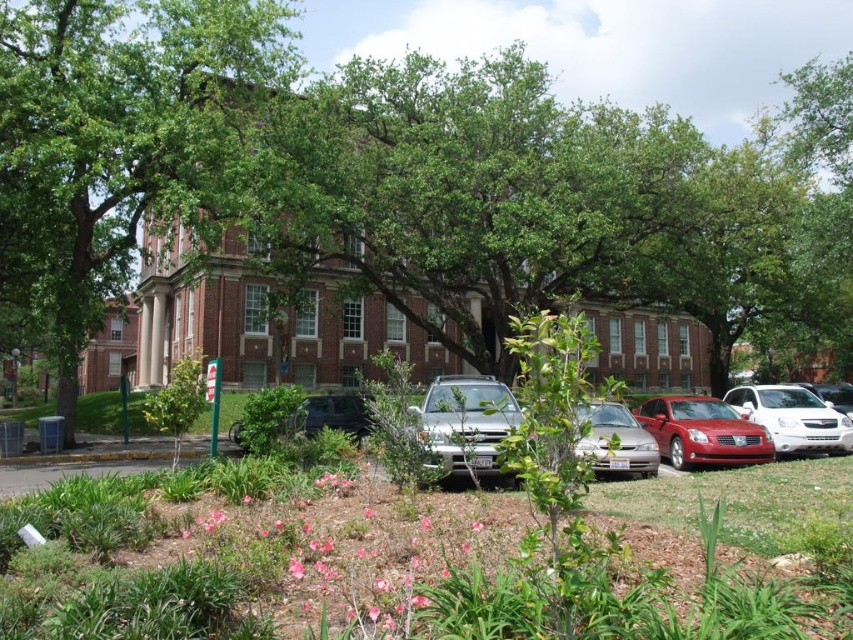
Question: Which is nearer to the green leafy shrubs at center?

Choices:
 (A) green leafy tree at center
 (B) green leafy tree at left
 (C) silver metallic suv at center
 (D) satin silver sedan at center

Answer: (C)

Question: Is green leafy shrubs at center positioned before green leafy tree at left?

Choices:
 (A) no
 (B) yes

Answer: (B)

Question: Can you confirm if green leafy tree at center is wider than glossy red sedan at center?

Choices:
 (A) no
 (B) yes

Answer: (B)

Question: Can you confirm if green leafy tree at left is positioned to the right of silver metallic suv at center?

Choices:
 (A) yes
 (B) no

Answer: (B)

Question: Estimate the real-world distances between objects in this image. Which object is closer to the green leafy shrubs at center?

Choices:
 (A) silver metallic suv at center
 (B) glossy red sedan at center

Answer: (A)

Question: Which of the following is the closest to the observer?

Choices:
 (A) (236, 129)
 (B) (735, 387)

Answer: (A)